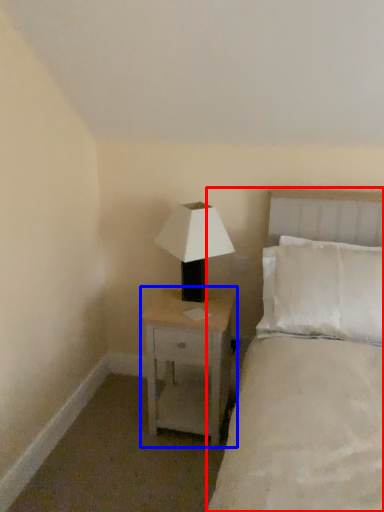
Question: Which point is further to the camera, bed (highlighted by a red box) or nightstand (highlighted by a blue box)?

Choices:
 (A) bed
 (B) nightstand

Answer: (B)